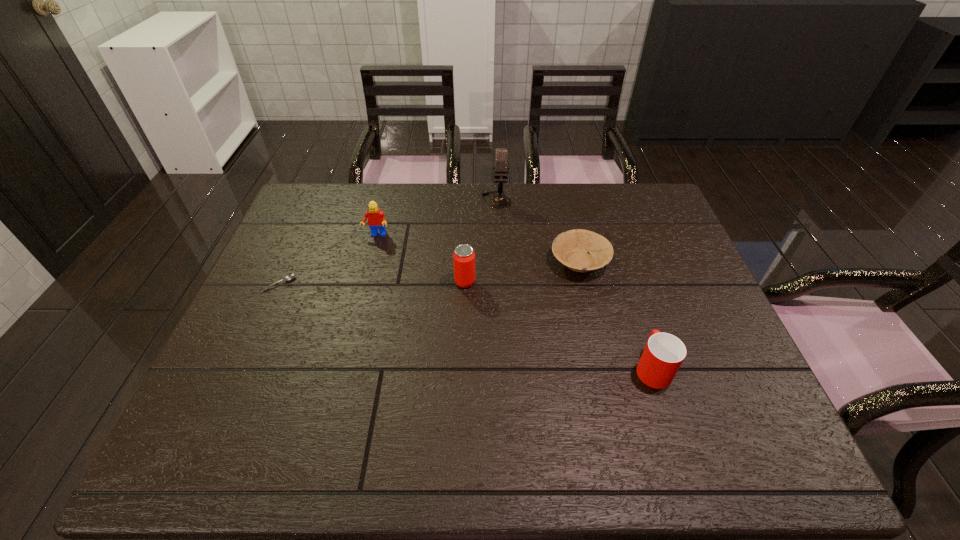
I want to click on free space that satisfies the following two spatial constraints: 1. on the front-facing side of the bowl; 2. on the left side of the farthest object, so [x=499, y=261].